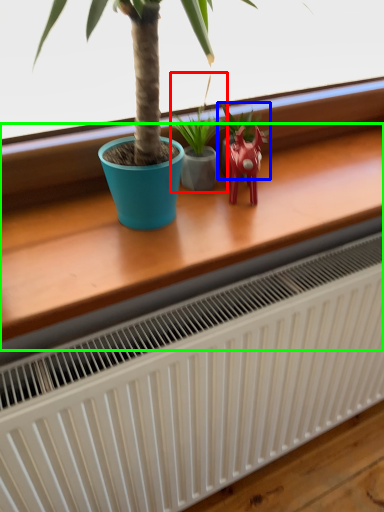
Question: Considering the real-world distances, which object is farthest from houseplant (highlighted by a red box)? houseplant (highlighted by a blue box) or table (highlighted by a green box)?

Choices:
 (A) houseplant
 (B) table

Answer: (B)